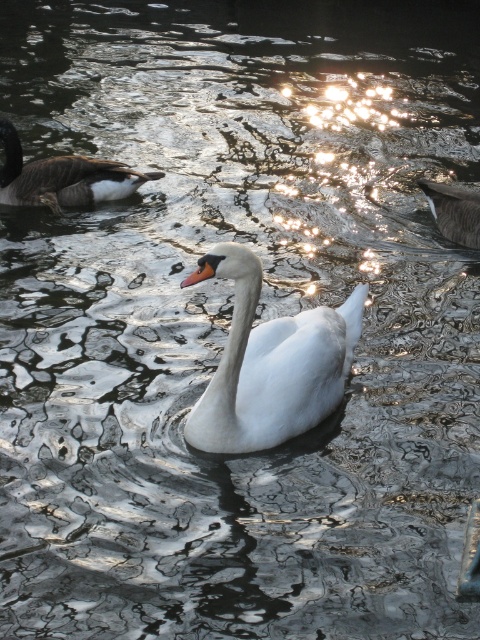
You are standing at the origin point of the image coordinate system. You see two points, point (78, 180) and point (476, 248). Which point is closer to you?

Point (476, 248) is closer to you because point (78, 180) is behind it.

You are a photographer trying to capture a photo of both the white glossy swan at center and the brown fuzzy duck at upper left. Since you want them to be in the same frame, can you confirm if they are positioned side by side horizontally?

The white glossy swan at center is to the right of brown fuzzy duck at upper left, so they are positioned side by side horizontally in the image.